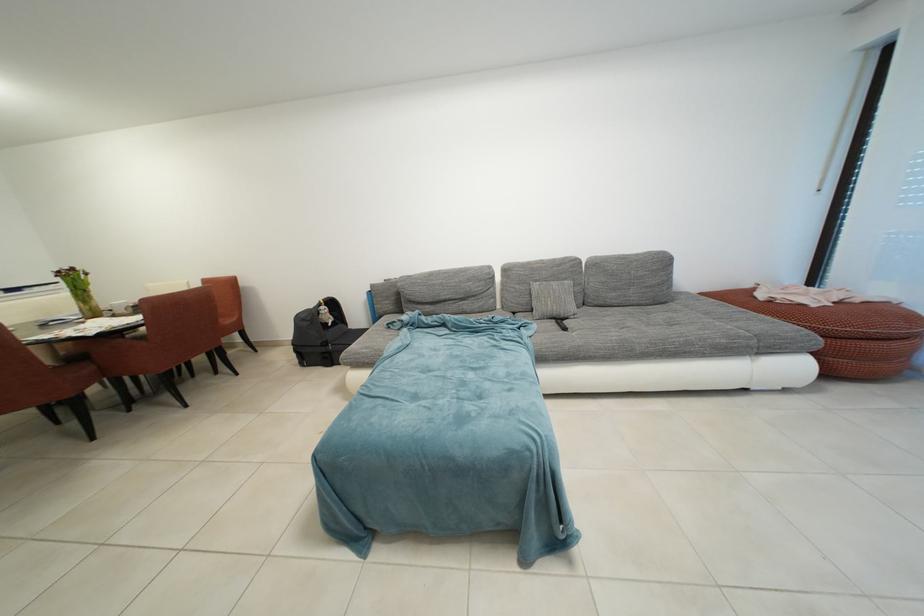
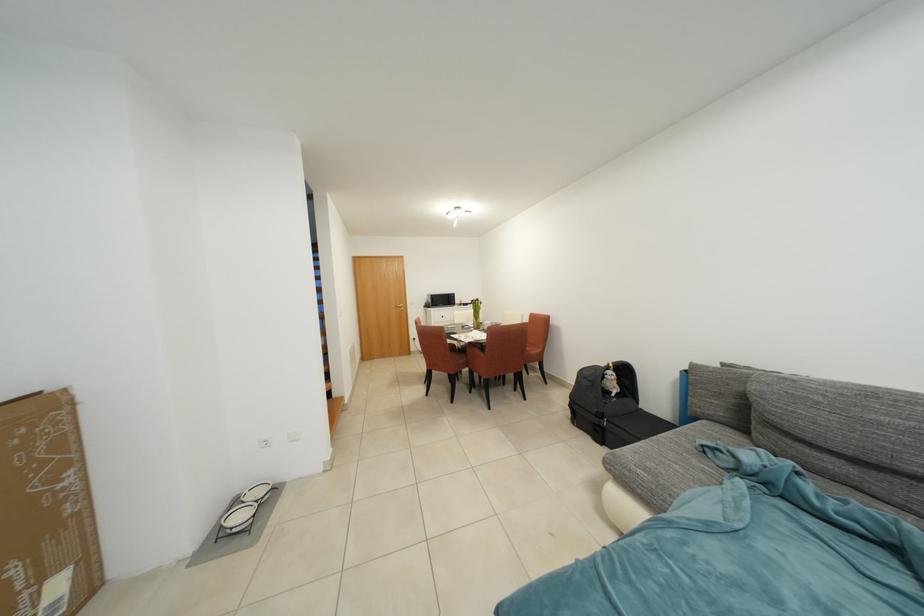
Question: The first image is from the beginning of the video and the second image is from the end. How did the camera likely rotate when shooting the video?

Choices:
 (A) Left
 (B) Right
 (C) Up
 (D) Down

Answer: (A)